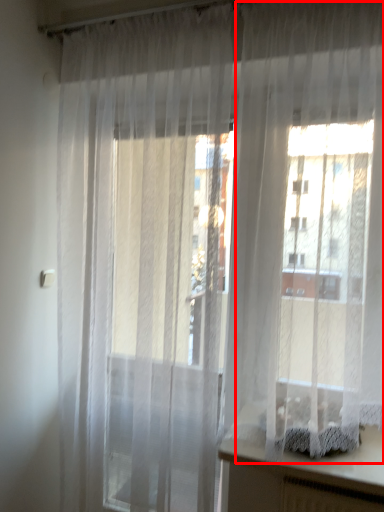
Question: From the image's perspective, what is the correct spatial relationship of curtain (annotated by the red box) in relation to vanity?

Choices:
 (A) below
 (B) above

Answer: (B)